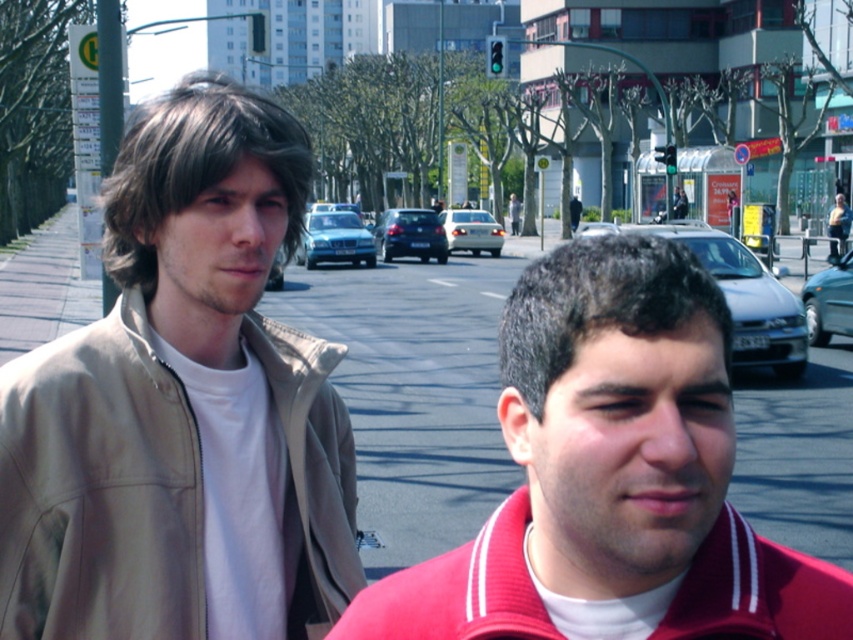
Does paved asphalt at lower center have a greater width compared to blue metallic sedan at center?

Yes.

Between point (822, 474) and point (335, 234), which one is positioned in front?

Point (822, 474)

Find the location of a particular element. paved asphalt at lower center is located at coordinates (413, 394).

Looking at this image, does blue metallic sedan at center appear over silver metallic sedan at center?

No, blue metallic sedan at center is not above silver metallic sedan at center.

Does blue metallic sedan at center appear on the right side of silver metallic sedan at center?

No, blue metallic sedan at center is not to the right of silver metallic sedan at center.

Find the location of a particular element. Image resolution: width=853 pixels, height=640 pixels. blue metallic sedan at center is located at coordinates (334, 240).

Who is shorter, blue metallic sedan at center or sleek black sedan at center?

sleek black sedan at center

Is blue metallic sedan at center taller than sleek black sedan at center?

Yes.

Which is in front, point (366, 236) or point (376, 225)?

Point (366, 236) is more forward.

Locate an element on the screen. blue metallic sedan at center is located at coordinates pyautogui.click(x=334, y=240).